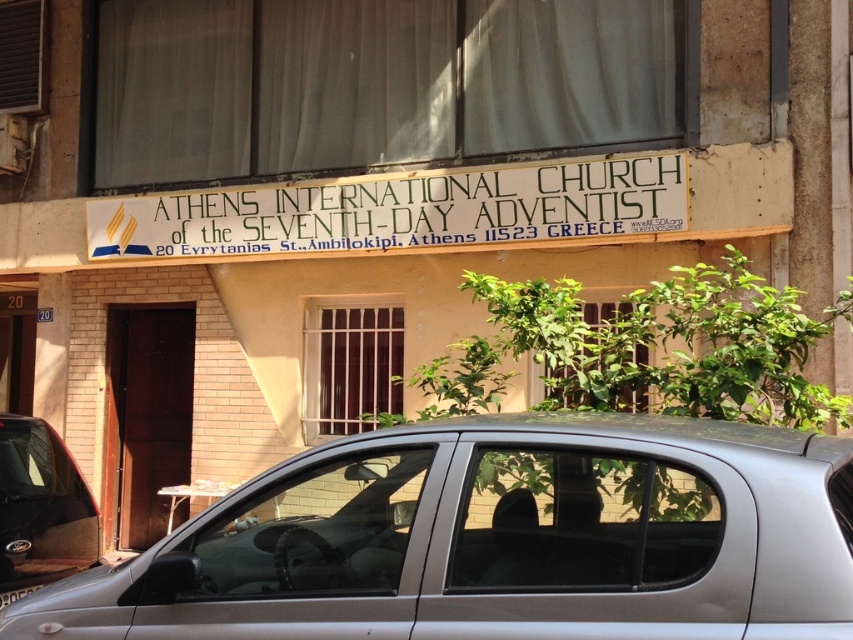
Question: Can you confirm if satin silver car at center is positioned above white painted wood sign at upper center?

Choices:
 (A) yes
 (B) no

Answer: (B)

Question: Is white painted wood sign at upper center positioned at the back of metallic gray car at lower left?

Choices:
 (A) no
 (B) yes

Answer: (B)

Question: Based on their relative distances, which object is farther from the metallic gray car at lower left?

Choices:
 (A) white sheer curtain at upper center
 (B) white painted wood sign at upper center

Answer: (A)

Question: Does satin silver car at center have a larger size compared to metallic gray car at lower left?

Choices:
 (A) yes
 (B) no

Answer: (A)

Question: Which is nearer to the white sheer curtain at upper center?

Choices:
 (A) metallic gray car at lower left
 (B) white painted wood sign at upper center
 (C) satin silver car at center

Answer: (B)

Question: Which of the following is the closest to the observer?

Choices:
 (A) white painted wood sign at upper center
 (B) satin silver car at center

Answer: (B)